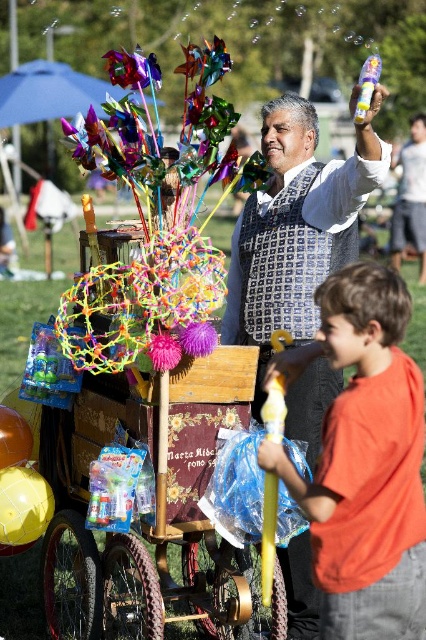
Does patterned fabric vest at center have a lesser width compared to purple fuzzy flower at center?

In fact, patterned fabric vest at center might be wider than purple fuzzy flower at center.

Does patterned fabric vest at center appear on the left side of purple fuzzy flower at center?

Answer: Incorrect, patterned fabric vest at center is not on the left side of purple fuzzy flower at center.

Does point (261, 298) come closer to viewer compared to point (161, 333)?

That is False.

Find the location of a particular element. This screenshot has height=640, width=426. patterned fabric vest at center is located at coordinates (296, 227).

Between orange matte shirt at right and translucent plastic bubble wand at upper center, which one has less height?

Standing shorter between the two is orange matte shirt at right.

Who is positioned more to the left, orange matte shirt at right or translucent plastic bubble wand at upper center?

orange matte shirt at right is more to the left.

Where is `orange matte shirt at right`? The image size is (426, 640). orange matte shirt at right is located at coordinates (363, 461).

Which of these two, purple fuzzy ball at center or translucent plastic bubble wand at upper center, stands taller?

With more height is translucent plastic bubble wand at upper center.

Describe the element at coordinates (198, 339) in the screenshot. I see `purple fuzzy ball at center` at that location.

Measure the distance between purple fuzzy ball at center and camera.

purple fuzzy ball at center and camera are 14.69 feet apart.

This screenshot has height=640, width=426. I want to click on purple fuzzy ball at center, so click(198, 339).